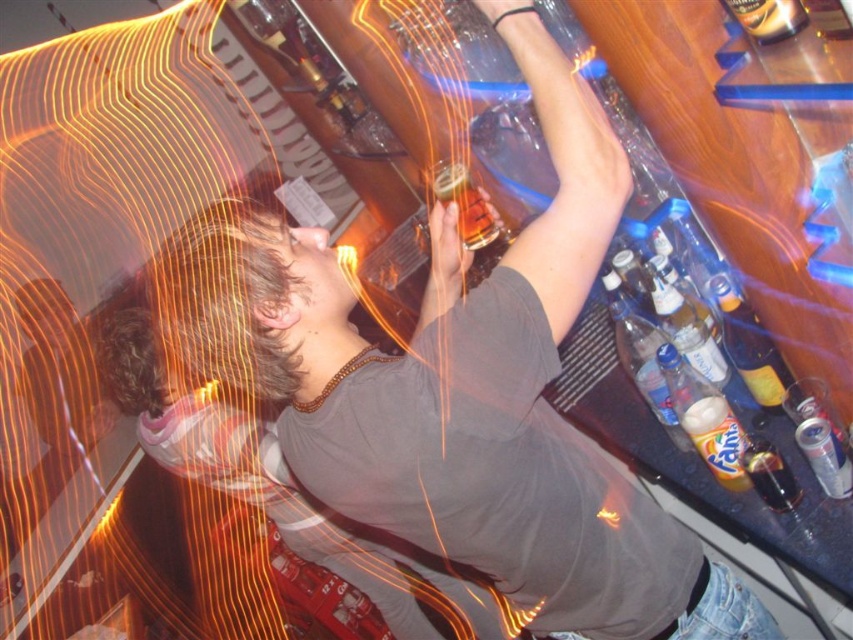
Question: Does translucent plastic bottle at upper right have a smaller size compared to yellow matte fanta can at center?

Choices:
 (A) no
 (B) yes

Answer: (A)

Question: Is translucent amber glass at upper center bigger than translucent plastic soda can at upper right?

Choices:
 (A) yes
 (B) no

Answer: (A)

Question: Can you confirm if clear glass bottle at center is thinner than gold metallic beer can at upper right?

Choices:
 (A) yes
 (B) no

Answer: (B)

Question: Which of the following is the closest to the observer?

Choices:
 (A) (685, 339)
 (B) (798, 24)
 (C) (735, 346)
 (D) (738, 467)

Answer: (B)

Question: Which of these objects is positioned closest to the gold metallic beer can at upper right?

Choices:
 (A) clear glass bottle at center
 (B) translucent amber glass at upper center
 (C) translucent plastic soda can at upper right
 (D) translucent plastic bottle at upper right

Answer: (D)

Question: Which of the following is the farthest from the observer?

Choices:
 (A) translucent plastic soda can at upper right
 (B) translucent plastic bottle at upper right
 (C) clear glass bottle at center

Answer: (C)